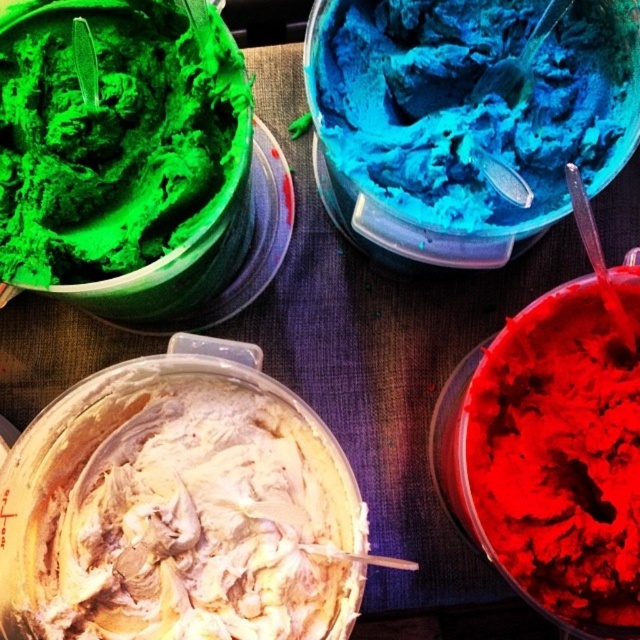
You are a baker who needs to choose a container for a dessert display. The blue matte ice cream at upper center and the matte red frosting at bottom right are both options. Which container has a larger volume capacity?

The blue matte ice cream at upper center is bigger than the matte red frosting at bottom right, so it has a larger volume capacity.

What is located at the point with coordinates (112, 138) in the image?

The point with coordinates (112, 138) indicates the location of the green matte ice cream at upper left.